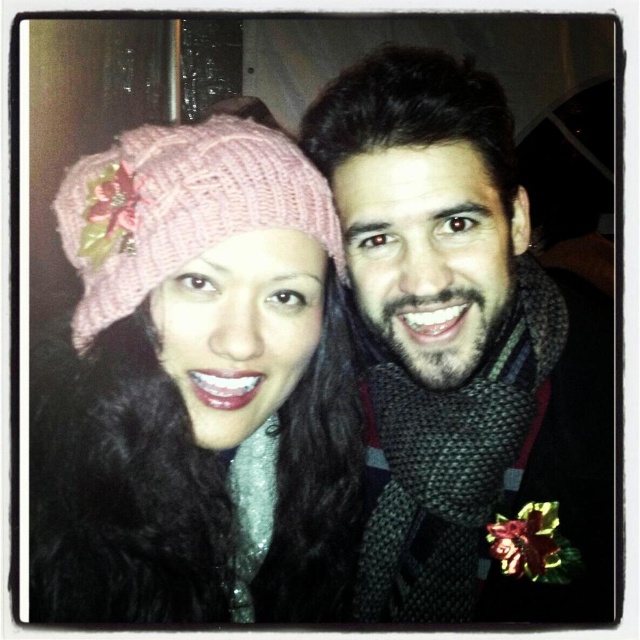
Describe the element at coordinates (198, 387) in the screenshot. This screenshot has height=640, width=640. I see `pink knitted hat at upper left` at that location.

Locate an element on the screen. pink knitted hat at upper left is located at coordinates (198, 387).

You are a GUI agent. You are given a task and a screenshot of the screen. Output one action in this format:
    pyautogui.click(x=<x>, y=<y>)
    Task: Click on the pink knitted hat at upper left
    
    Given the screenshot: What is the action you would take?
    pyautogui.click(x=198, y=387)

Who is higher up, knitted scarf at center or pink knitted hat at left?

pink knitted hat at left

Is point (476, 77) closer to viewer compared to point (212, 232)?

That is False.

Which is in front, point (516, 584) or point (324, 179)?

Point (324, 179) is more forward.

This screenshot has width=640, height=640. I want to click on knitted scarf at center, so click(461, 339).

Which is below, pink knitted hat at upper left or pink knitted hat at left?

pink knitted hat at upper left is below.

Describe the element at coordinates (198, 387) in the screenshot. I see `pink knitted hat at upper left` at that location.

The image size is (640, 640). I want to click on pink knitted hat at upper left, so click(198, 387).

Locate an element on the screen. The height and width of the screenshot is (640, 640). pink knitted hat at upper left is located at coordinates (198, 387).